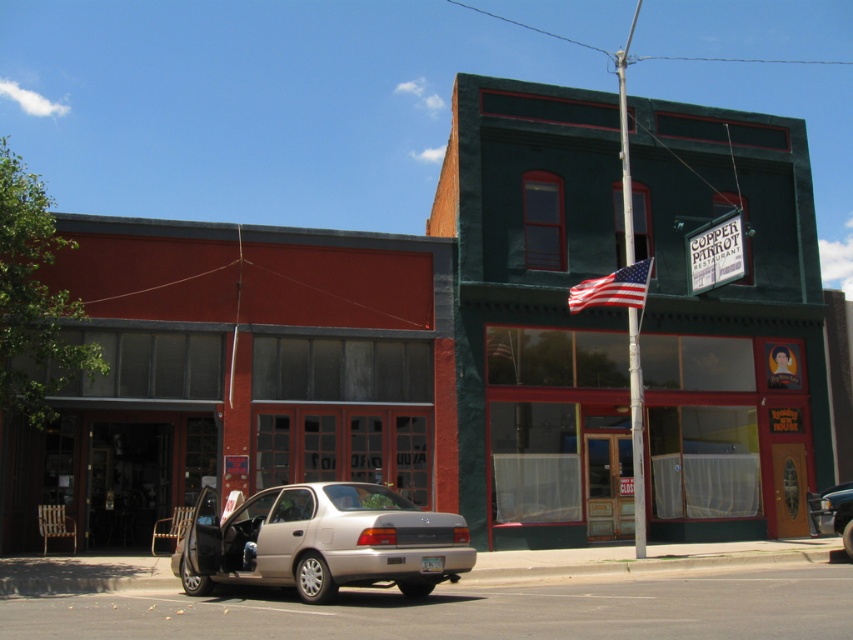
This screenshot has width=853, height=640. Describe the element at coordinates (236, 372) in the screenshot. I see `matte red building at center` at that location.

Does matte red building at center come in front of satin gold sedan at lower left?

No.

Identify the location of matte red building at center. (236, 372).

In order to click on green painted building at center in this screenshot , I will do `click(537, 312)`.

Does green painted building at center have a larger size compared to matte red building at center?

Correct, green painted building at center is larger in size than matte red building at center.

Describe the element at coordinates (537, 312) in the screenshot. This screenshot has width=853, height=640. I see `green painted building at center` at that location.

At what (x,y) coordinates should I click in order to perform the action: click on green painted building at center. Please return your answer as a coordinate pair (x, y). Looking at the image, I should click on (537, 312).

Is matte red building at center thinner than american flag at center?

In fact, matte red building at center might be wider than american flag at center.

Who is lower down, matte red building at center or american flag at center?

Positioned lower is matte red building at center.

Locate an element on the screen. matte red building at center is located at coordinates (236, 372).

The height and width of the screenshot is (640, 853). I want to click on matte red building at center, so click(x=236, y=372).